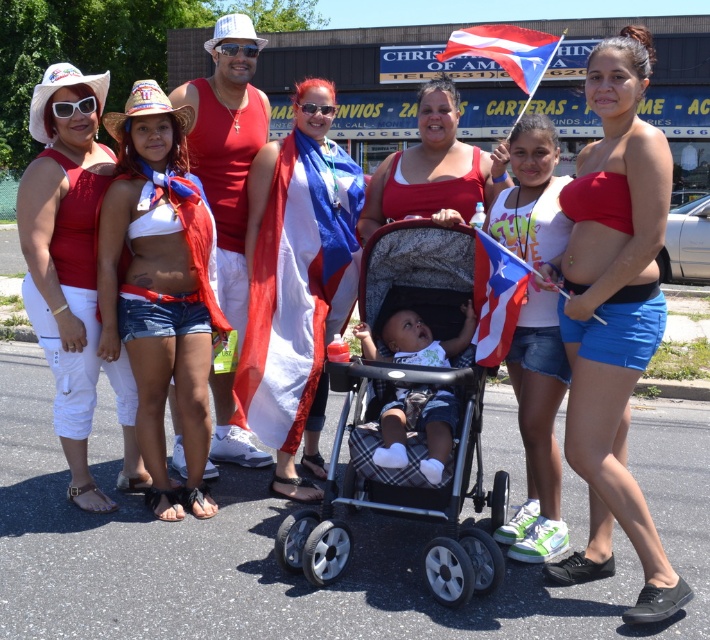
Is red-white-blue fabric at center thinner than red-white-blue fabric flag at center?

In fact, red-white-blue fabric at center might be wider than red-white-blue fabric flag at center.

Which is in front, point (310, 451) or point (479, 243)?

Point (479, 243)

The height and width of the screenshot is (640, 710). I want to click on red-white-blue fabric at center, so click(295, 284).

Which is below, black plastic baby carriage at center or red-white-blue fabric at center?

black plastic baby carriage at center is below.

Is point (300, 557) closer to viewer compared to point (300, 124)?

Yes.

Where is `black plastic baby carriage at center`? Image resolution: width=710 pixels, height=640 pixels. black plastic baby carriage at center is located at coordinates (403, 484).

Is point (258, 227) more distant than point (515, 26)?

No, (258, 227) is in front of (515, 26).

Does red-white-blue fabric at center appear over red-white-blue fabric flag at upper center?

No.

What do you see at coordinates (295, 284) in the screenshot? The height and width of the screenshot is (640, 710). I see `red-white-blue fabric at center` at bounding box center [295, 284].

Identify the location of red-white-blue fabric at center. (295, 284).